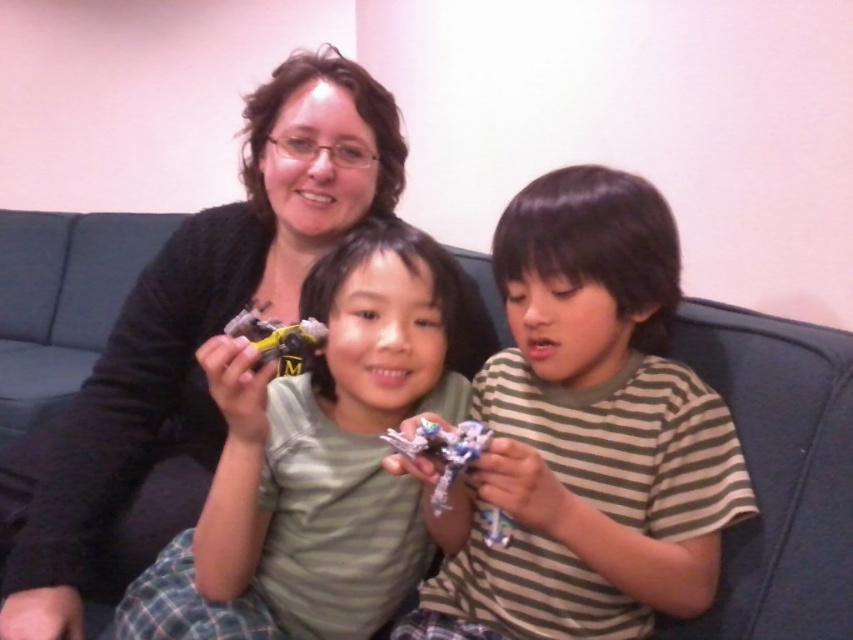
Question: Does metallic silver toy at center appear on the right side of yellow plastic toy at center?

Choices:
 (A) yes
 (B) no

Answer: (A)

Question: Can you confirm if matte plastic toy car at center is bigger than yellow plastic toy at center?

Choices:
 (A) yes
 (B) no

Answer: (A)

Question: Which of the following is the farthest from the observer?

Choices:
 (A) (471, 442)
 (B) (305, 339)
 (C) (637, 337)

Answer: (C)

Question: Can you confirm if metallic silver toy at center is positioned below yellow plastic toy at center?

Choices:
 (A) no
 (B) yes

Answer: (B)

Question: Which object appears farthest from the camera in this image?

Choices:
 (A) metallic silver robot at center
 (B) metallic silver toy at center

Answer: (B)

Question: Which point appears farthest from the camera in this image?

Choices:
 (A) (712, 452)
 (B) (404, 442)

Answer: (A)